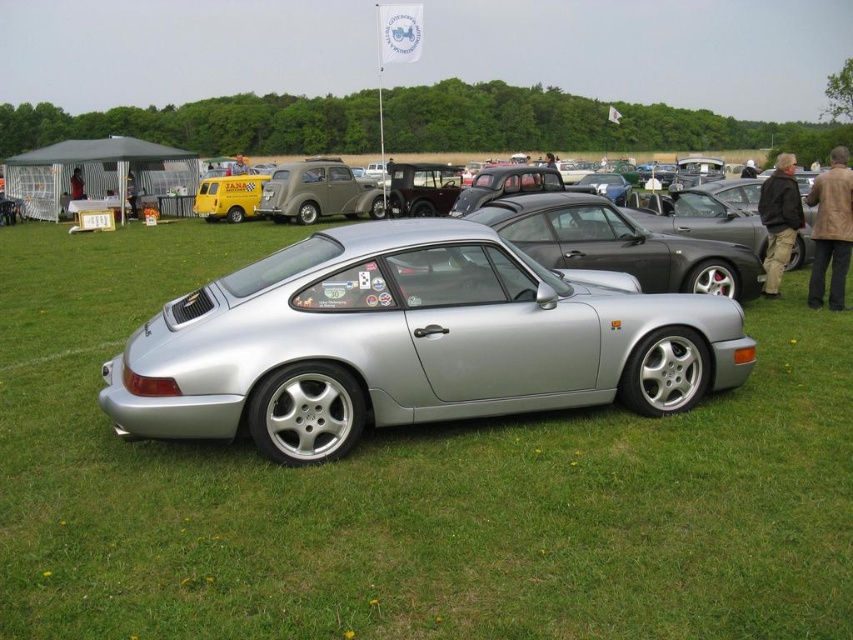
You are standing in front of the silver Porsche 911 at the car event. There are two points marked on the car, one at point (479, 627) and the other at point (607, 396). Which point is closer to you?

Point (479, 627) is closer to the viewer than point (607, 396).

You are a photographer at the car event and want to capture the matte gray sedan at center without any obstructions. Since you are standing at the back of the event area, which direction should you move to ensure the green grass at center does not block your view?

The green grass at center is in front of the matte gray sedan at center. To avoid obstruction, you should move forward towards the matte gray sedan at center so that the grass is behind the car in your shot.